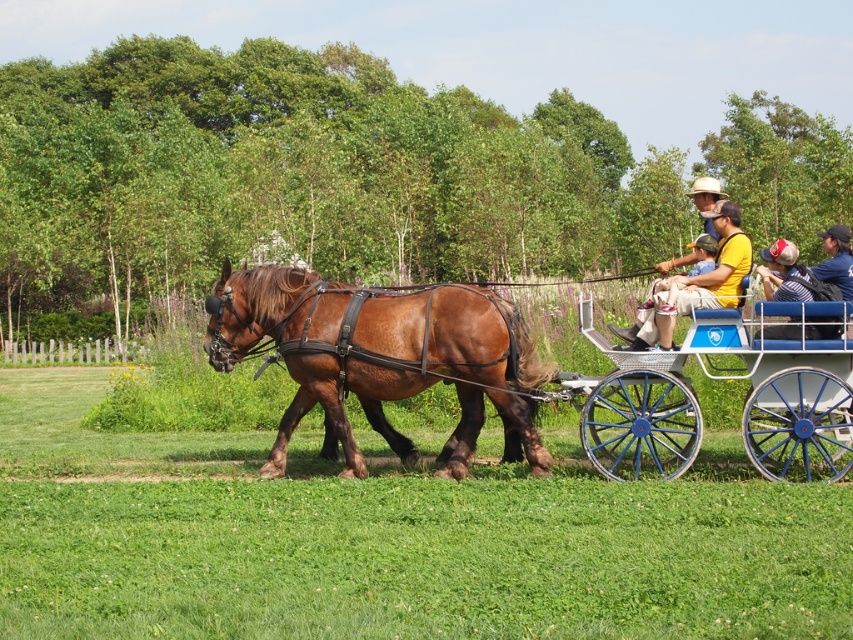
Question: Does brown leather horse at center have a smaller size compared to denim jacket at center?

Choices:
 (A) yes
 (B) no

Answer: (B)

Question: Is brown leather horse at center further to the viewer compared to denim jacket at center?

Choices:
 (A) no
 (B) yes

Answer: (B)

Question: Which object is positioned farthest from the denim jacket at center?

Choices:
 (A) brown leather horse at center
 (B) matte brown horse at center

Answer: (A)

Question: Estimate the real-world distances between objects in this image. Which object is closer to the matte brown horse at center?

Choices:
 (A) denim jacket at center
 (B) brown leather horse at center

Answer: (B)

Question: Which object is farther from the camera taking this photo?

Choices:
 (A) brown leather horse at center
 (B) matte brown horse at center
 (C) denim jacket at center

Answer: (B)

Question: Is brown leather horse at center behind matte brown horse at center?

Choices:
 (A) yes
 (B) no

Answer: (B)